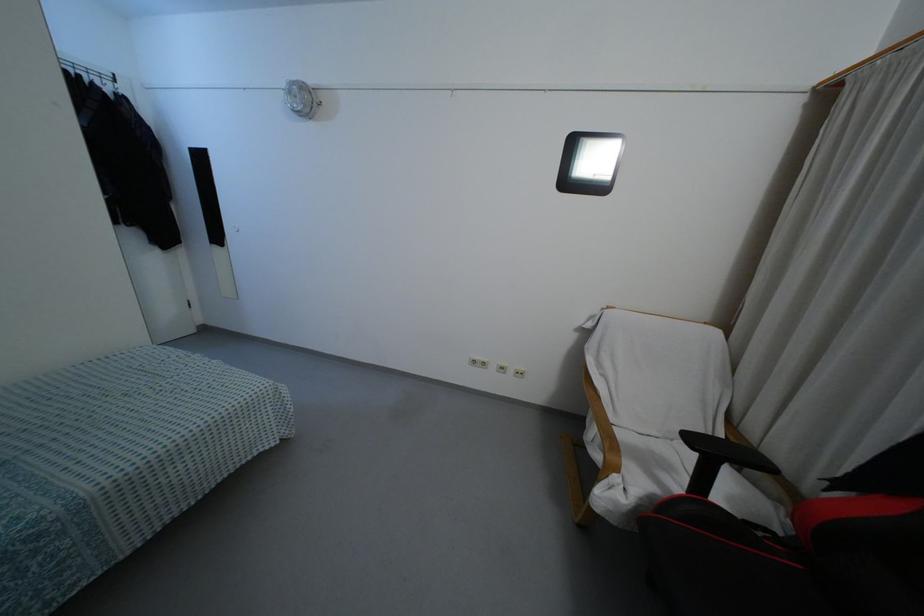
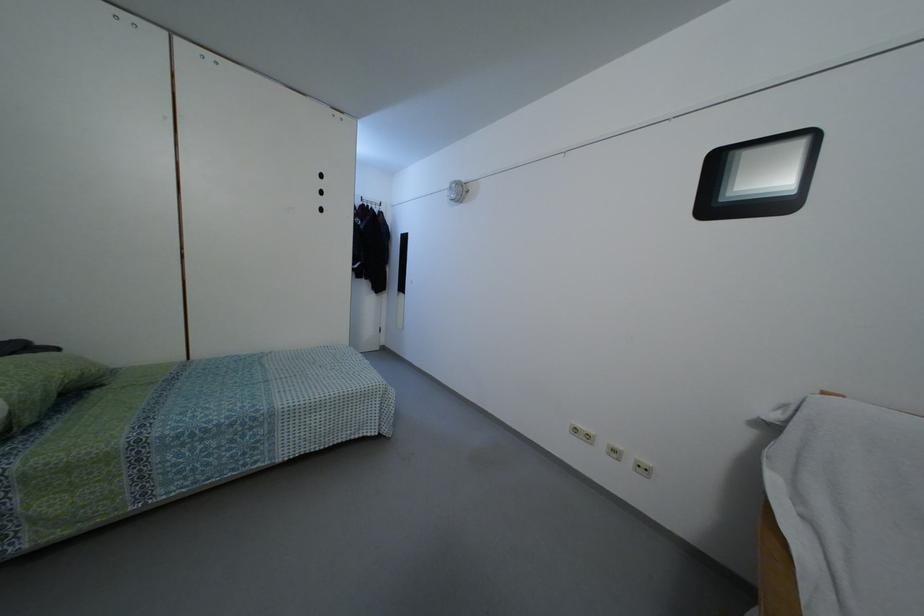
Where in the second image is the point corresponding to (x=503, y=371) from the first image?

(614, 456)